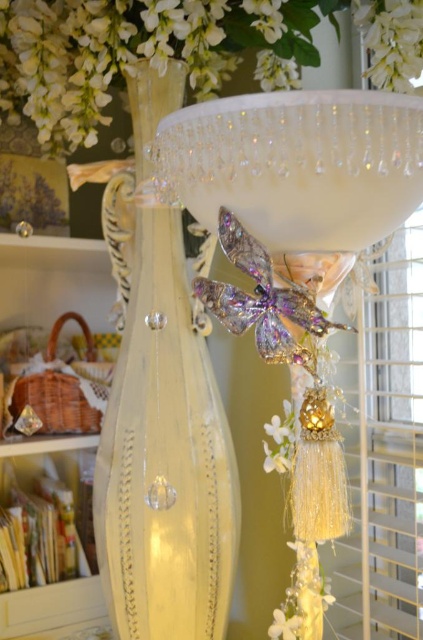
Does clear crystal bowl at upper center have a greater height compared to white matte flower at upper center?

No.

Which is in front, point (308, 176) or point (422, 20)?

Point (308, 176) is in front.

Identify the location of clear crystal bowl at upper center. (297, 164).

Who is positioned more to the left, clear glass vase at center or clear crystal bowl at upper center?

From the viewer's perspective, clear glass vase at center appears more on the left side.

Between clear glass vase at center and clear crystal bowl at upper center, which one is positioned higher?

clear crystal bowl at upper center is above.

Where is `clear glass vase at center`? clear glass vase at center is located at coordinates (164, 458).

Does point (417, 45) come farther from viewer compared to point (297, 637)?

No, (417, 45) is in front of (297, 637).

Measure the distance from white matte flower at upper center to white matte flower at lower center.

The distance of white matte flower at upper center from white matte flower at lower center is 31.37 inches.

Locate an element on the screen. white matte flower at upper center is located at coordinates (390, 40).